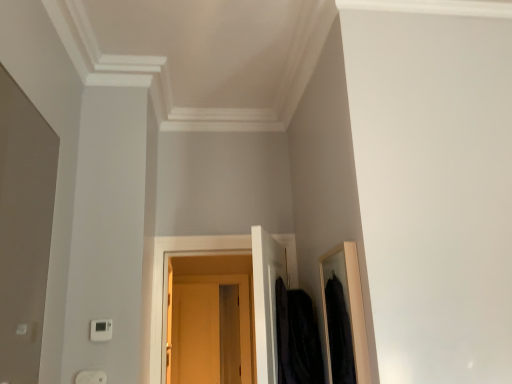
Question: Should I look upward or downward to see matte wood door at center?

Choices:
 (A) down
 (B) up

Answer: (A)

Question: Is white plastic electric outlet at lower left directly adjacent to matte wood door at center?

Choices:
 (A) no
 (B) yes

Answer: (A)

Question: Is white plastic electric outlet at lower left aimed at matte wood door at center?

Choices:
 (A) yes
 (B) no

Answer: (B)

Question: Considering the relative sizes of white plastic electric outlet at lower left and matte wood door at center in the image provided, is white plastic electric outlet at lower left bigger than matte wood door at center?

Choices:
 (A) no
 (B) yes

Answer: (A)

Question: Does white plastic electric outlet at lower left appear on the left side of matte wood door at center?

Choices:
 (A) no
 (B) yes

Answer: (B)

Question: From a real-world perspective, does white plastic electric outlet at lower left stand above matte wood door at center?

Choices:
 (A) no
 (B) yes

Answer: (A)

Question: Does white plastic electric outlet at lower left have a smaller size compared to matte wood door at center?

Choices:
 (A) yes
 (B) no

Answer: (A)

Question: Is velvet black coat at right oriented towards matte wood door at center?

Choices:
 (A) no
 (B) yes

Answer: (A)

Question: Is velvet black coat at right taller than matte wood door at center?

Choices:
 (A) no
 (B) yes

Answer: (A)

Question: Does velvet black coat at right appear on the left side of matte wood door at center?

Choices:
 (A) no
 (B) yes

Answer: (A)

Question: From the image's perspective, is velvet black coat at right located above matte wood door at center?

Choices:
 (A) no
 (B) yes

Answer: (B)

Question: Is the depth of velvet black coat at right greater than that of matte wood door at center?

Choices:
 (A) no
 (B) yes

Answer: (A)

Question: Is velvet black coat at right next to matte wood door at center?

Choices:
 (A) yes
 (B) no

Answer: (B)

Question: Is white plastic electric outlet at lower left bigger than white plastic thermostat at lower left?

Choices:
 (A) no
 (B) yes

Answer: (B)